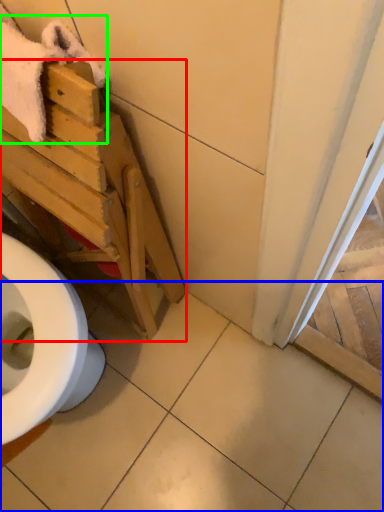
Question: Which object is the closest to the furniture (highlighted by a red box)? Choose among these: tile (highlighted by a blue box) or bath towel (highlighted by a green box).

Choices:
 (A) tile
 (B) bath towel

Answer: (B)